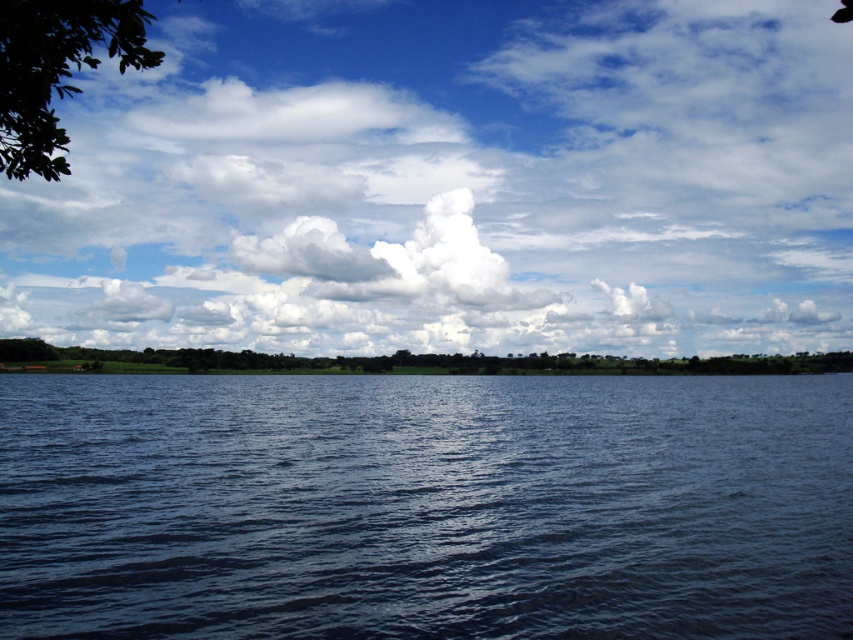
Question: Is blue sky at upper center to the right of green leafy tree at center from the viewer's perspective?

Choices:
 (A) yes
 (B) no

Answer: (A)

Question: Which is farther from the dark blue water at center?

Choices:
 (A) green leafy tree at upper left
 (B) green leafy tree at center

Answer: (B)

Question: Which of the following is the closest to the observer?

Choices:
 (A) (624, 369)
 (B) (33, 64)
 (C) (444, 97)
 (D) (509, 500)

Answer: (B)

Question: Is dark blue water at center positioned at the back of green leafy tree at upper left?

Choices:
 (A) yes
 (B) no

Answer: (A)

Question: Among these points, which one is farthest from the camera?

Choices:
 (A) (447, 596)
 (B) (3, 355)
 (C) (16, 333)

Answer: (C)

Question: Is blue sky at upper center closer to the viewer compared to green leafy tree at center?

Choices:
 (A) yes
 (B) no

Answer: (B)